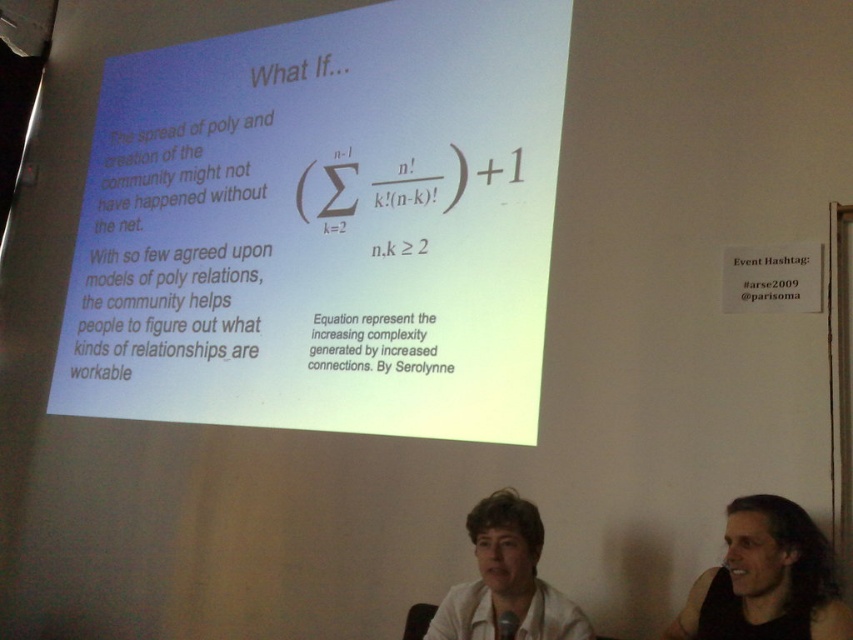
Question: Is white paper at center bigger than white matte shirt at center?

Choices:
 (A) no
 (B) yes

Answer: (B)

Question: Which point is farther to the camera?

Choices:
 (A) black hair at lower right
 (B) white paper at center
 (C) white matte shirt at center

Answer: (B)

Question: Is black hair at lower right to the left of white matte shirt at center from the viewer's perspective?

Choices:
 (A) no
 (B) yes

Answer: (A)

Question: Which is nearer to the white paper at center?

Choices:
 (A) black hair at lower right
 (B) white matte shirt at center

Answer: (B)

Question: Is white paper at center to the right of white matte shirt at center from the viewer's perspective?

Choices:
 (A) no
 (B) yes

Answer: (A)

Question: Which point is closer to the camera taking this photo?

Choices:
 (A) (819, 570)
 (B) (496, 605)
 (C) (436, 145)

Answer: (A)